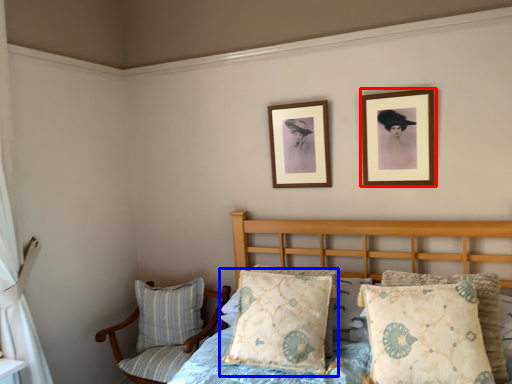
Question: Which object is further to the camera taking this photo, picture frame (highlighted by a red box) or pillow (highlighted by a blue box)?

Choices:
 (A) picture frame
 (B) pillow

Answer: (A)